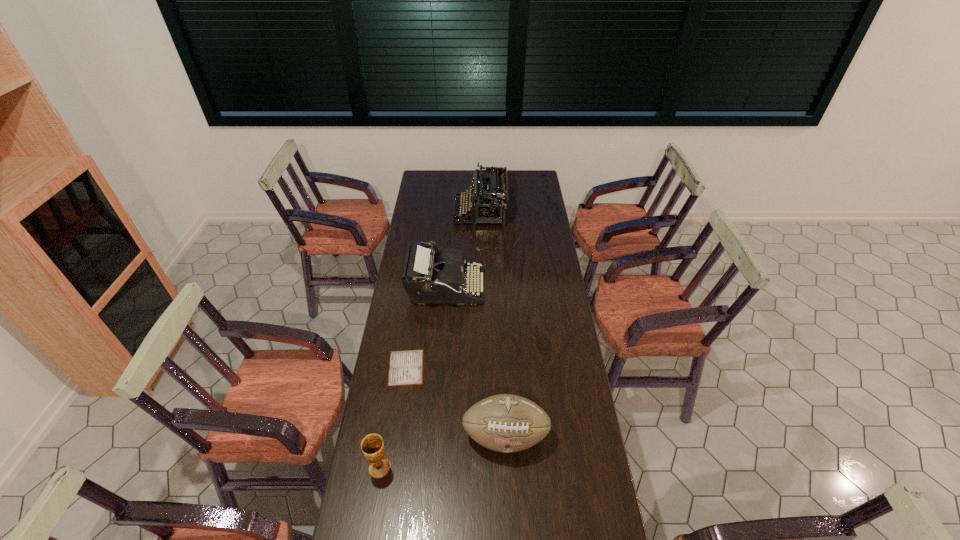
Where is `the farther typewriter`? The image size is (960, 540). the farther typewriter is located at coordinates pos(490,201).

This screenshot has width=960, height=540. I want to click on the tallest object, so click(x=490, y=201).

You are a GUI agent. You are given a task and a screenshot of the screen. Output one action in this format:
    pyautogui.click(x=<x>, y=<y>)
    Task: Click on the second farthest object
    The height and width of the screenshot is (540, 960).
    Given the screenshot: What is the action you would take?
    pyautogui.click(x=429, y=277)

Identify the location of the nearer typewriter. (429, 277).

At what (x,y) coordinates should I click in order to perform the action: click on football (American). Please return your answer as a coordinate pair (x, y). Looking at the image, I should click on (506, 423).

Locate an element on the screen. The height and width of the screenshot is (540, 960). chalice is located at coordinates (372, 445).

Where is `the shortest object`? This screenshot has height=540, width=960. the shortest object is located at coordinates (406, 367).

Where is `the third farthest object`? The image size is (960, 540). the third farthest object is located at coordinates (406, 367).

Identify the location of free space located on the typing side of the farthest object. (445, 212).

Find the location of a particular element. The height and width of the screenshot is (540, 960). vacant space located 0.220m on the typing side of the farthest object is located at coordinates (415, 212).